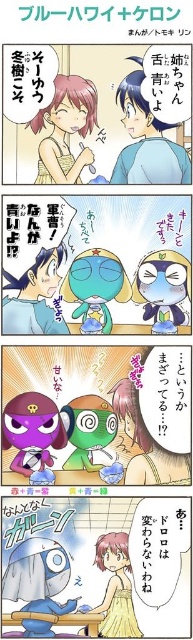
Question: Can you confirm if matte pink hair at upper left is positioned to the left of matte yellow dress at lower center?

Choices:
 (A) no
 (B) yes

Answer: (B)

Question: Is matte pink hair at upper left to the right of matte yellow dress at lower center from the viewer's perspective?

Choices:
 (A) no
 (B) yes

Answer: (A)

Question: Is matte pink hair at upper left wider than matte yellow dress at lower center?

Choices:
 (A) yes
 (B) no

Answer: (A)